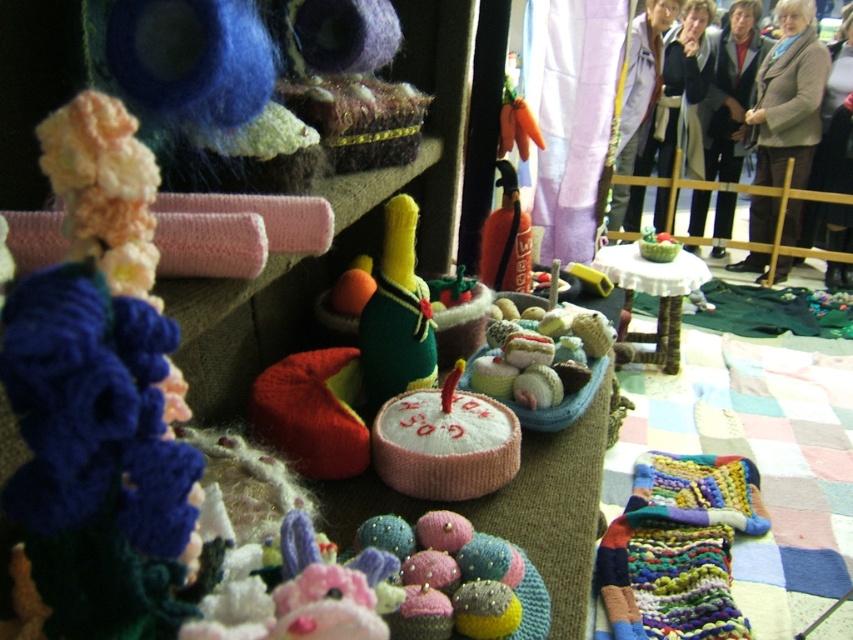
Is point (608, 275) closer to viewer compared to point (631, 104)?

Yes, point (608, 275) is closer to viewer.

Image resolution: width=853 pixels, height=640 pixels. What are the coordinates of `white lace table at center` in the screenshot? It's located at (654, 294).

Who is shorter, knitted yarn toy at left or multicolored knitted scarf at lower right?

Standing shorter between the two is knitted yarn toy at left.

Can you confirm if knitted yarn toy at left is positioned below multicolored knitted scarf at lower right?

Incorrect, knitted yarn toy at left is not positioned below multicolored knitted scarf at lower right.

Between point (15, 314) and point (743, 458), which one is positioned behind?

The point (743, 458) is behind.

Where is `knitted yarn toy at left`? Image resolution: width=853 pixels, height=640 pixels. knitted yarn toy at left is located at coordinates (100, 394).

Can you confirm if knitted beige sweater at center is taller than velvet-like carrot at center?

Yes.

Who is higher up, knitted beige sweater at center or velvet-like carrot at center?

knitted beige sweater at center is higher up.

Where is `knitted beige sweater at center`? The image size is (853, 640). knitted beige sweater at center is located at coordinates (788, 97).